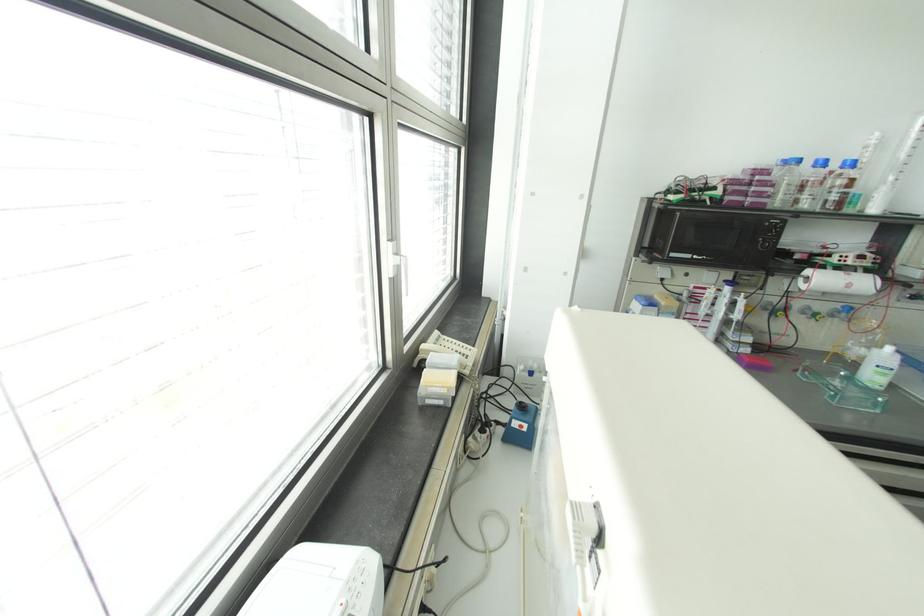
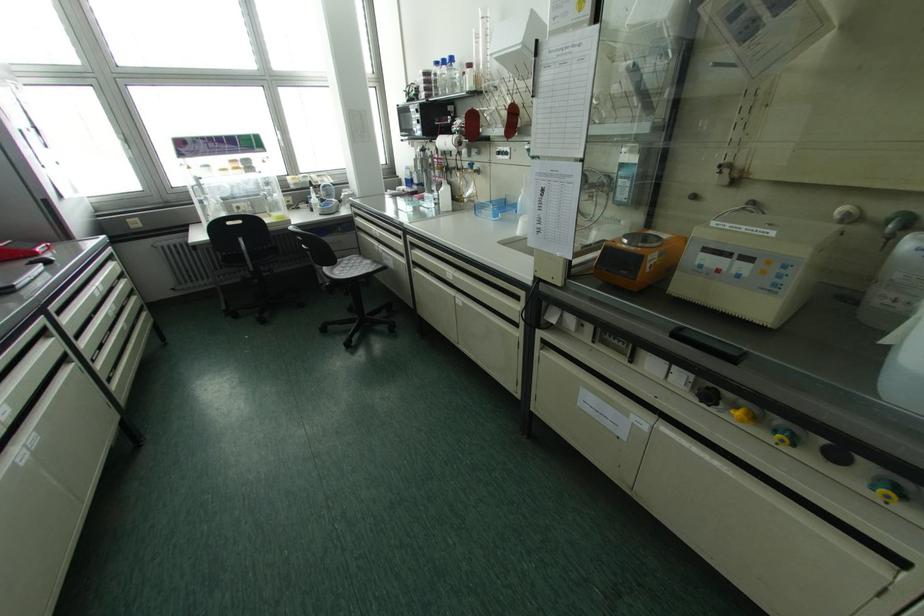
In the second image, find the point that corresponds to the point at 797,160 in the first image.

(435, 63)